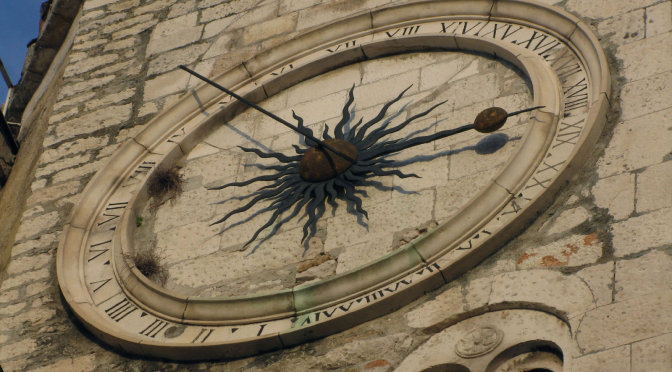
Where is `wall above clock`? The height and width of the screenshot is (372, 672). wall above clock is located at coordinates (336, 13).